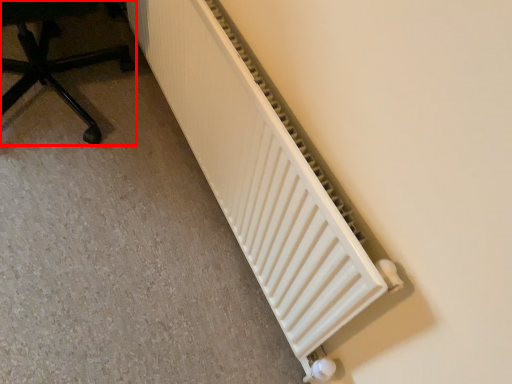
Question: From the image's perspective, considering the relative positions of furniture (annotated by the red box) and radiator in the image provided, where is furniture (annotated by the red box) located with respect to the staircase?

Choices:
 (A) above
 (B) below

Answer: (A)